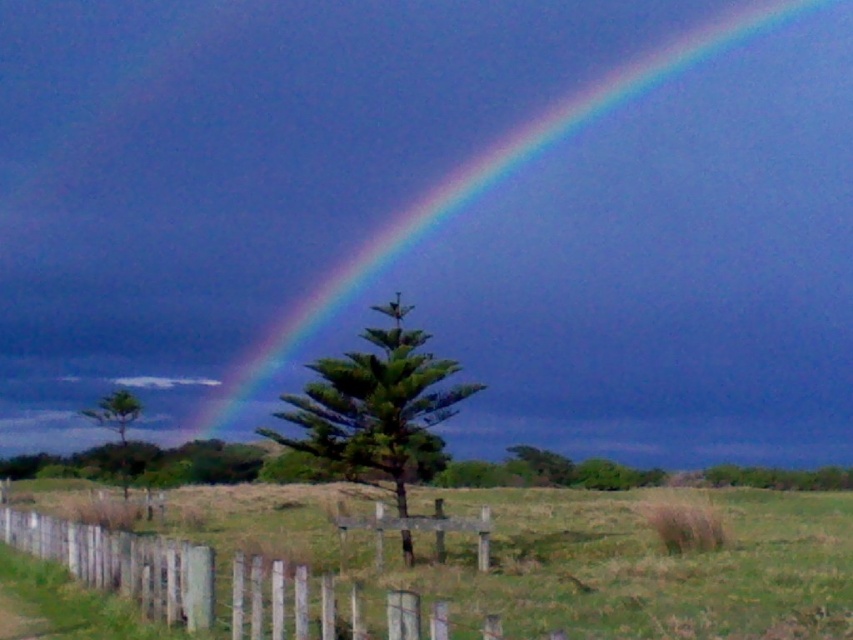
Question: Which point appears closest to the camera in this image?

Choices:
 (A) (582, 156)
 (B) (167, 573)

Answer: (B)

Question: Is rainbow at upper center thinner than wooden picket fence at center?

Choices:
 (A) no
 (B) yes

Answer: (A)

Question: Which point is farther to the camera?

Choices:
 (A) (798, 342)
 (B) (236, 616)

Answer: (A)

Question: Which of the following is the closest to the observer?

Choices:
 (A) wooden picket fence at center
 (B) rainbow at upper center

Answer: (A)

Question: Does rainbow at upper center have a lesser width compared to wooden picket fence at center?

Choices:
 (A) no
 (B) yes

Answer: (A)

Question: Is rainbow at upper center bigger than wooden picket fence at center?

Choices:
 (A) no
 (B) yes

Answer: (B)